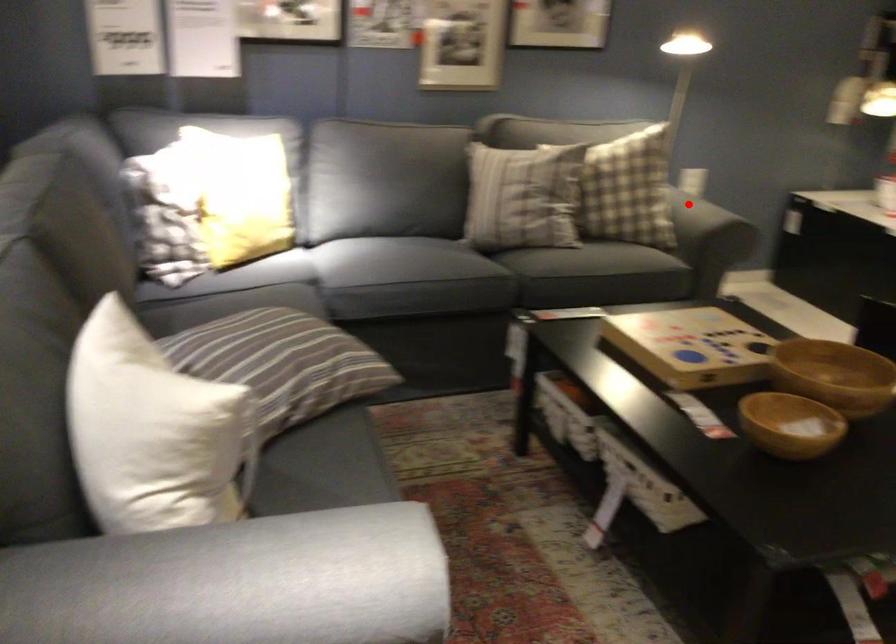
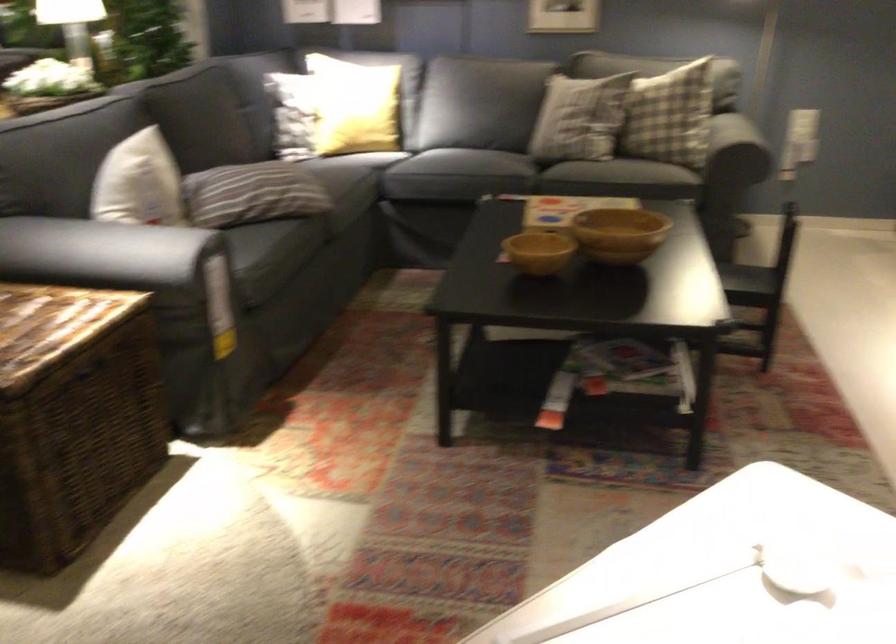
Where in the second image is the point corresponding to the highlighted location from the first image?

(668, 115)